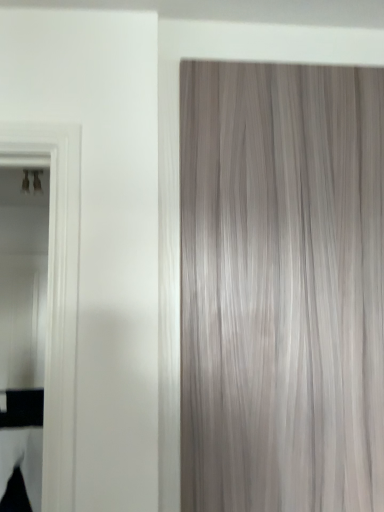
The image size is (384, 512). What do you see at coordinates (282, 287) in the screenshot? I see `gray textured curtain at right` at bounding box center [282, 287].

What is the approximate width of gray textured curtain at right?

gray textured curtain at right is 2.47 inches in width.

You are a GUI agent. You are given a task and a screenshot of the screen. Output one action in this format:
    pyautogui.click(x=<x>, y=<y>)
    Task: Click on the gray textured curtain at right
    This screenshot has width=384, height=512.
    Given the screenshot: What is the action you would take?
    pyautogui.click(x=282, y=287)

This screenshot has height=512, width=384. What are the coordinates of `gray textured curtain at right` in the screenshot? It's located at (282, 287).